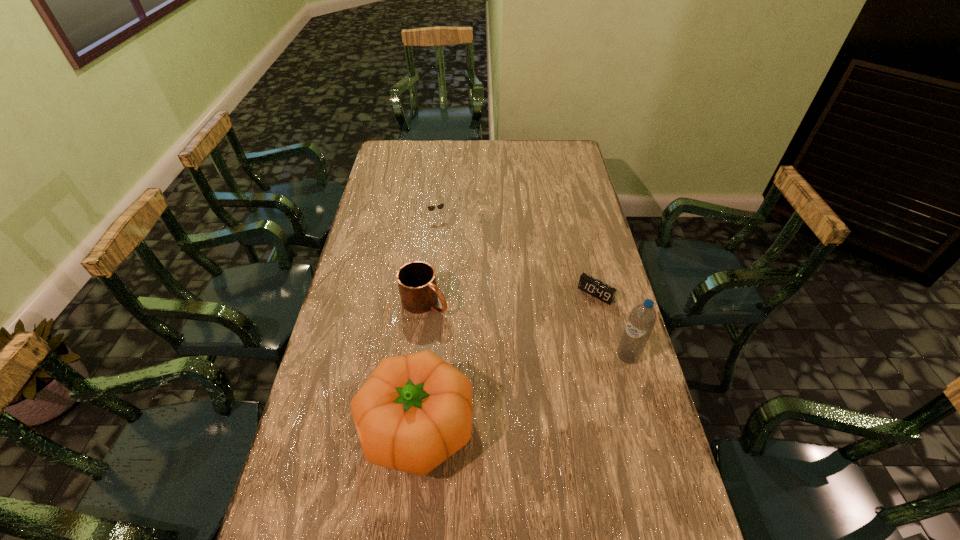
Where is `free spot that satisfies the following two spatial constraints: 1. on the front side of the third tallest object; 2. on the carved face of the nearest object`? free spot that satisfies the following two spatial constraints: 1. on the front side of the third tallest object; 2. on the carved face of the nearest object is located at coordinates (411, 427).

Where is `vacant point that satisfies the following two spatial constraints: 1. on the front side of the nearest object; 2. on the carved face of the second shortest object`? vacant point that satisfies the following two spatial constraints: 1. on the front side of the nearest object; 2. on the carved face of the second shortest object is located at coordinates (415, 427).